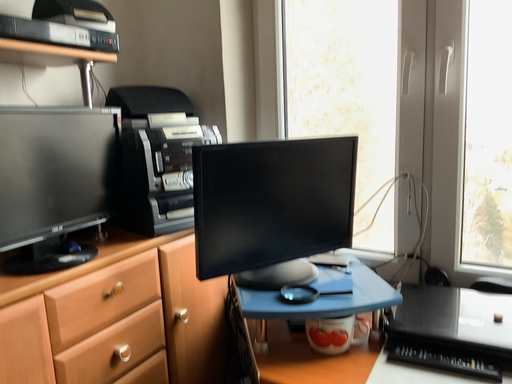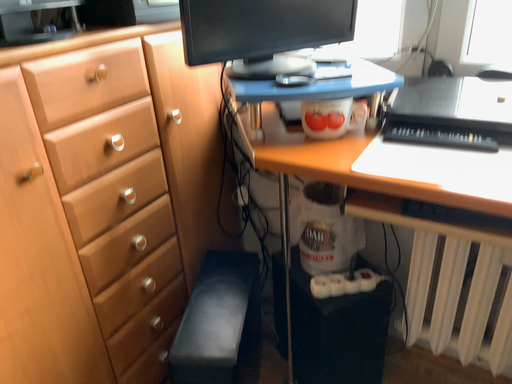
Question: Which way did the camera rotate in the video?

Choices:
 (A) rotated downward
 (B) rotated upward

Answer: (A)